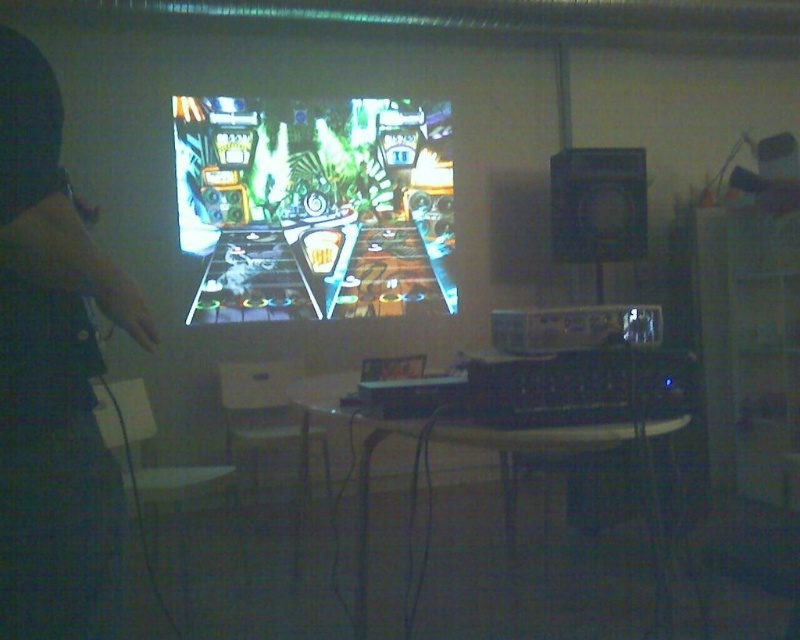
Question: Does dark fabric hand at left appear under shiny plastic pinball machine at center?

Choices:
 (A) no
 (B) yes

Answer: (B)

Question: Which point is closer to the camera taking this photo?

Choices:
 (A) (64, 186)
 (B) (381, 257)

Answer: (A)

Question: Can you confirm if dark fabric hand at left is smaller than shiny plastic pinball machine at center?

Choices:
 (A) yes
 (B) no

Answer: (A)

Question: Does dark fabric hand at left have a lesser width compared to shiny plastic pinball machine at center?

Choices:
 (A) yes
 (B) no

Answer: (A)